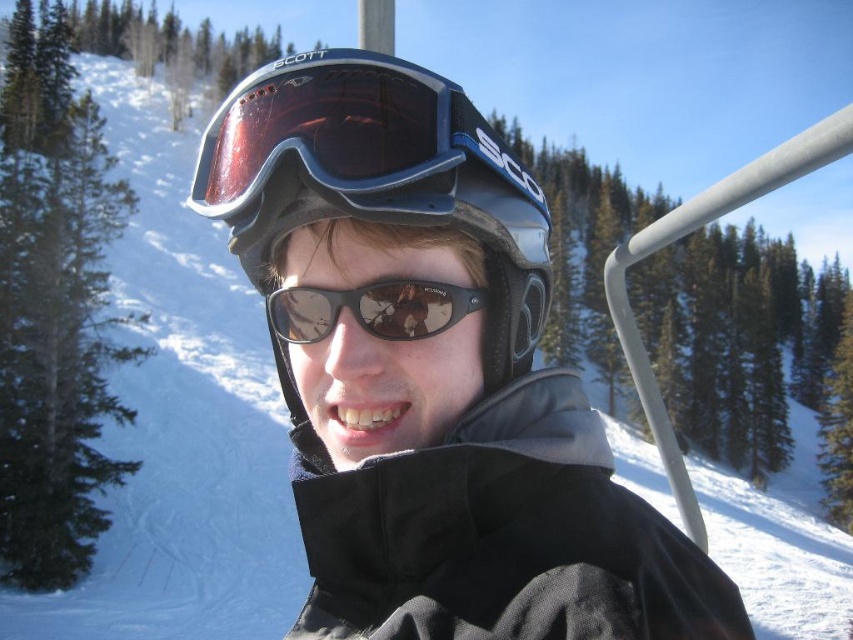
Question: Can you confirm if matte black helmet at center is thinner than matte blue goggles at center?

Choices:
 (A) no
 (B) yes

Answer: (A)

Question: Is matte black helmet at center further to the viewer compared to black reflective sunglasses at center?

Choices:
 (A) no
 (B) yes

Answer: (A)

Question: Which point is farther from the camera taking this photo?

Choices:
 (A) (422, 291)
 (B) (401, 177)
 (C) (375, 92)

Answer: (A)

Question: Is matte blue goggles at center positioned at the back of black reflective sunglasses at center?

Choices:
 (A) yes
 (B) no

Answer: (B)

Question: Which object is positioned farthest from the matte black helmet at center?

Choices:
 (A) black reflective sunglasses at center
 (B) matte blue goggles at center

Answer: (A)

Question: Estimate the real-world distances between objects in this image. Which object is farther from the matte blue goggles at center?

Choices:
 (A) black reflective sunglasses at center
 (B) matte black helmet at center

Answer: (A)